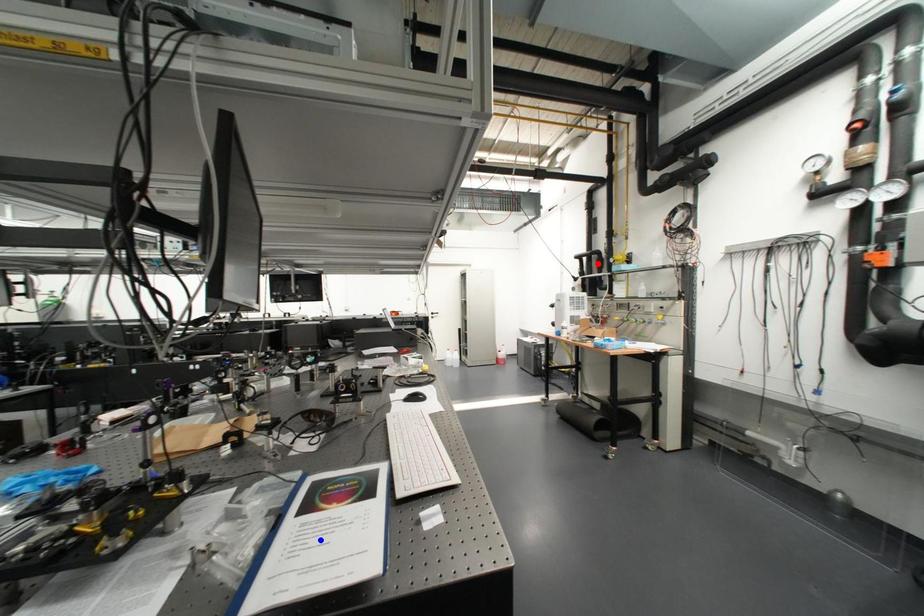
Question: Which of the two points in the image is closer to the camera?

Choices:
 (A) Blue point is closer.
 (B) Red point is closer.

Answer: (A)